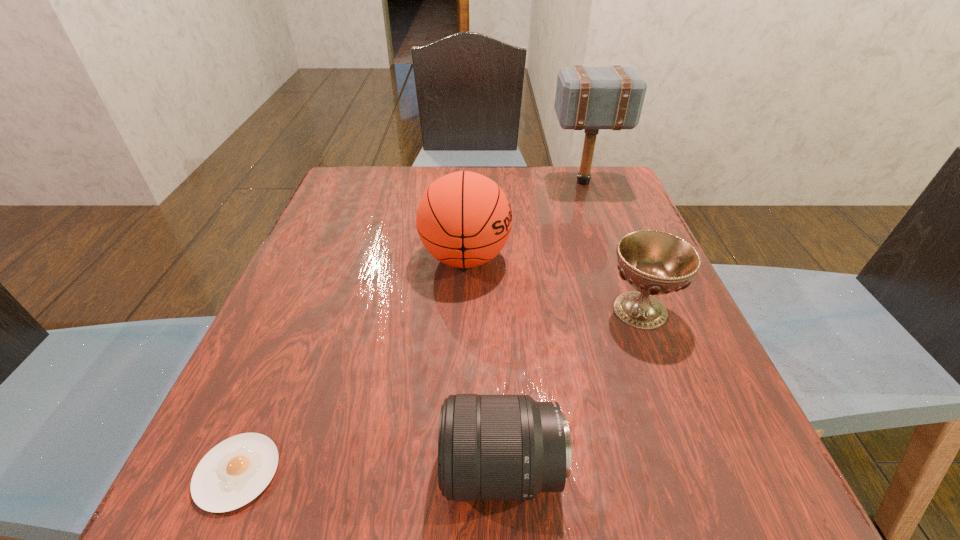
The width and height of the screenshot is (960, 540). I want to click on mallet, so click(x=591, y=98).

The image size is (960, 540). Identify the location of the tallest object. (591, 98).

What are the coordinates of `the second tallest object` in the screenshot? It's located at (464, 219).

I want to click on chalice, so click(654, 263).

Locate an element on the screen. This screenshot has width=960, height=540. telephoto lens is located at coordinates (490, 447).

I want to click on egg yolk, so click(233, 473).

Find the location of a particular element. The height and width of the screenshot is (540, 960). the leftmost object is located at coordinates (233, 473).

Locate an element on the screen. vacant position located on the striking surface of the tallest object is located at coordinates (519, 182).

The height and width of the screenshot is (540, 960). I want to click on vacant space located on the striking surface of the tallest object, so click(404, 182).

Where is `free space located on the striking surface of the tallest object`? free space located on the striking surface of the tallest object is located at coordinates (449, 182).